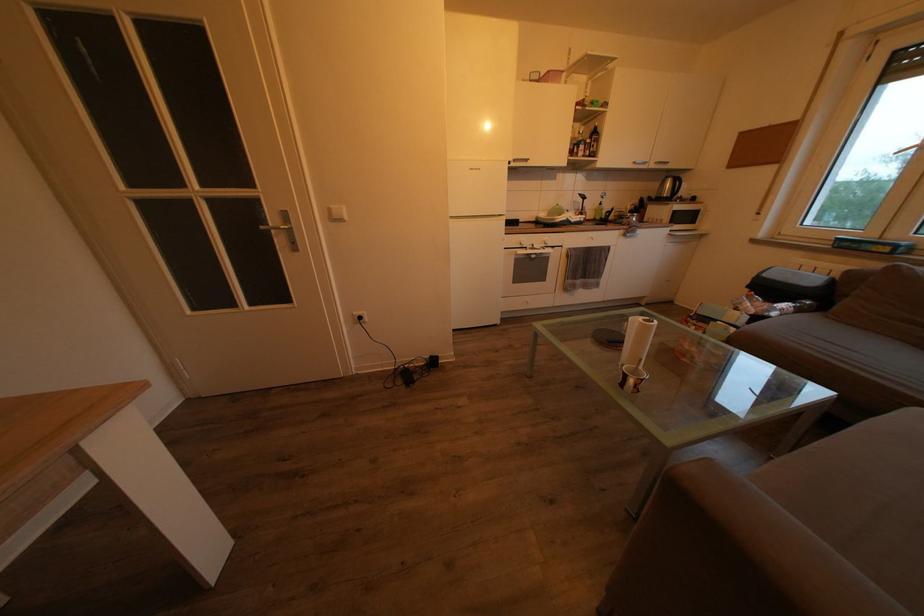
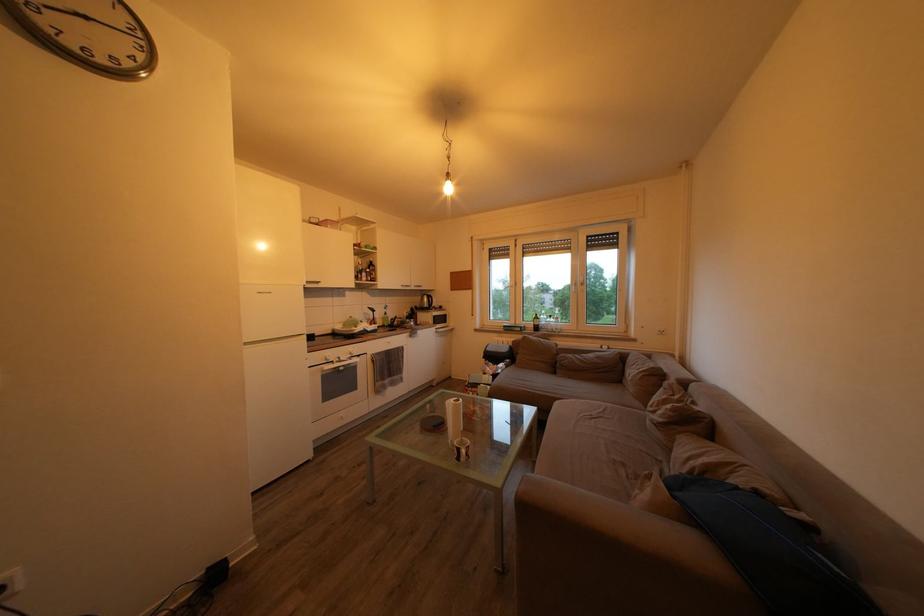
Locate, in the second image, the point that corresponds to point (543, 253) in the first image.

(349, 363)